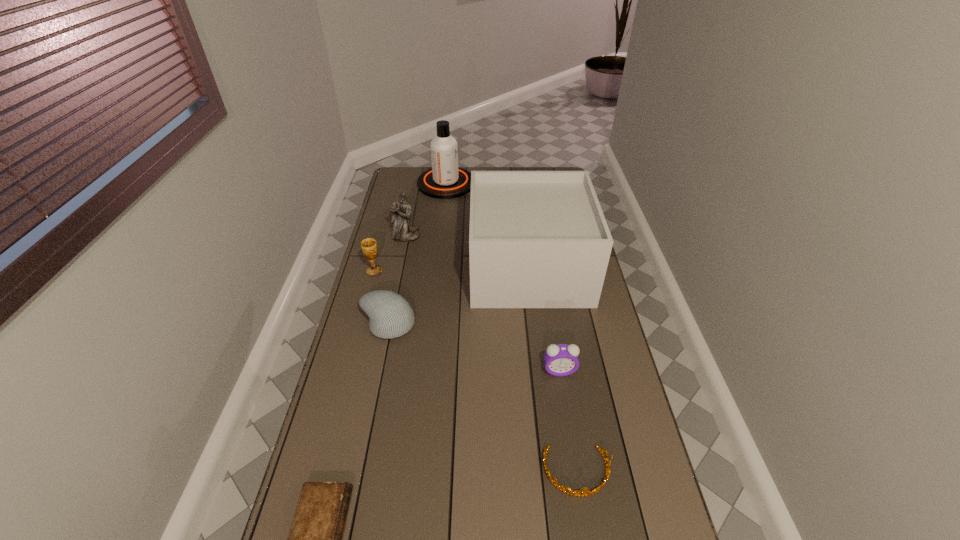
The height and width of the screenshot is (540, 960). I want to click on the farthest object, so click(x=445, y=180).

The image size is (960, 540). In order to click on box in this screenshot , I will do `click(538, 239)`.

Where is `the sixth shortest object`? the sixth shortest object is located at coordinates (402, 231).

The width and height of the screenshot is (960, 540). I want to click on chalice, so point(369,246).

I want to click on beanie, so click(x=390, y=315).

The height and width of the screenshot is (540, 960). I want to click on the third nearest object, so click(560, 360).

Locate an element on the screen. The image size is (960, 540). tiara is located at coordinates (578, 493).

I want to click on vacant space located 0.200m on the right of the cleansing agent, so click(x=514, y=184).

Locate an element on the screen. This screenshot has height=540, width=960. free space located on the side of the box with the window is located at coordinates (432, 267).

What are the coordinates of `free space located 0.240m on the side of the box with the window` in the screenshot? It's located at (412, 267).